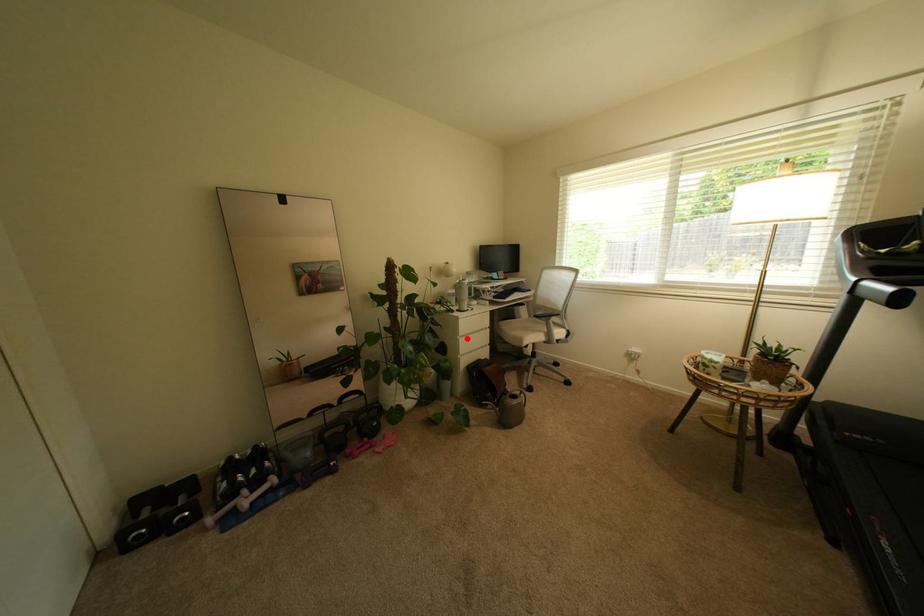
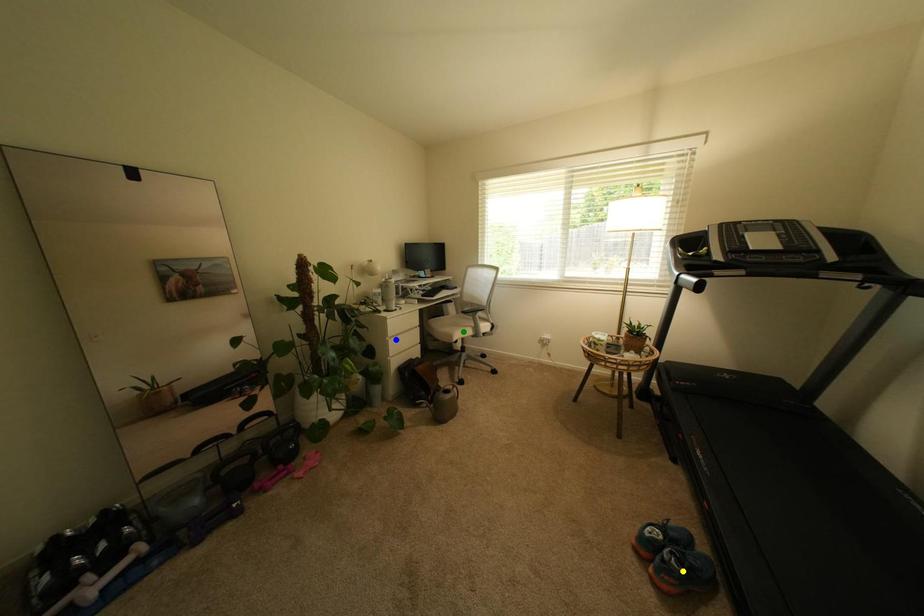
Question: I am providing you with two images of the same scene from different viewpoints. A red point is marked on the first image. You are given multiple points on the second image. Which point in image 2 is actually the same real-world point as the red point in image 1?

Choices:
 (A) yellow point
 (B) green point
 (C) blue point

Answer: (C)